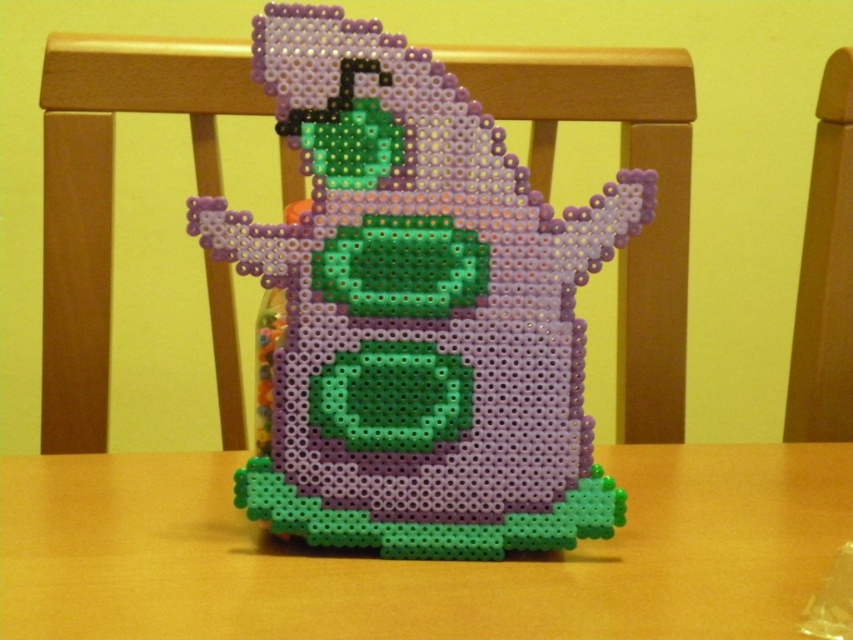
Question: Does wooden table at center appear over wooden chair at right?

Choices:
 (A) no
 (B) yes

Answer: (A)

Question: Which point appears farthest from the camera in this image?

Choices:
 (A) (795, 387)
 (B) (438, 604)

Answer: (A)

Question: Can you confirm if perler bead ghost at center is wider than wooden table at center?

Choices:
 (A) no
 (B) yes

Answer: (A)

Question: Which of the following is the farthest from the observer?

Choices:
 (A) (842, 109)
 (B) (198, 224)
 (C) (219, 609)

Answer: (A)

Question: Estimate the real-world distances between objects in this image. Which object is farther from the perler bead ghost at center?

Choices:
 (A) wooden table at center
 (B) wooden chair at right

Answer: (B)

Question: Is perler bead ghost at center above wooden table at center?

Choices:
 (A) no
 (B) yes

Answer: (B)